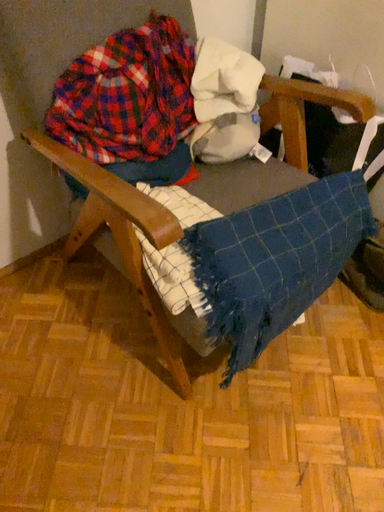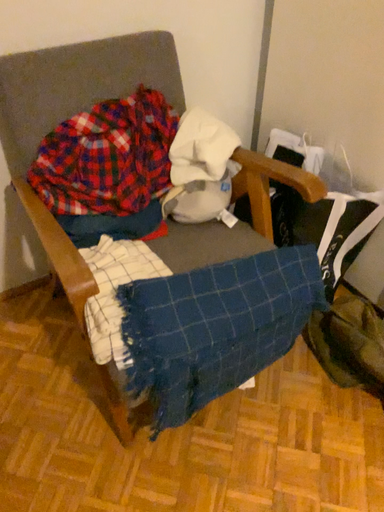
Question: How did the camera likely rotate when shooting the video?

Choices:
 (A) rotated left
 (B) rotated right

Answer: (A)